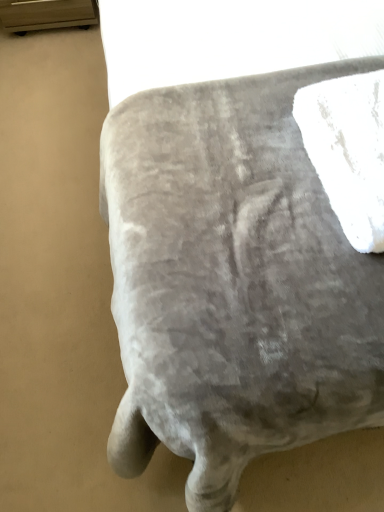
The height and width of the screenshot is (512, 384). I want to click on velvet ottoman at center, so click(233, 282).

This screenshot has height=512, width=384. What do you see at coordinates (233, 282) in the screenshot?
I see `velvet ottoman at center` at bounding box center [233, 282].

What do you see at coordinates (348, 151) in the screenshot?
I see `white fluffy bath towel at upper right` at bounding box center [348, 151].

Find the location of a particular element. The height and width of the screenshot is (512, 384). white fluffy bath towel at upper right is located at coordinates (348, 151).

Find the location of `velvet ottoman at center`. velvet ottoman at center is located at coordinates (233, 282).

Does velvet ottoman at center appear on the right side of white fluffy bath towel at upper right?

In fact, velvet ottoman at center is to the left of white fluffy bath towel at upper right.

Looking at this image, considering the positions of objects velvet ottoman at center and white fluffy bath towel at upper right in the image provided, who is in front, velvet ottoman at center or white fluffy bath towel at upper right?

white fluffy bath towel at upper right is closer to the camera.

Is point (138, 382) closer to viewer compared to point (360, 131)?

Yes, it is.

From the image's perspective, which one is positioned lower, velvet ottoman at center or white fluffy bath towel at upper right?

white fluffy bath towel at upper right, from the image's perspective.

From a real-world perspective, is velvet ottoman at center physically above white fluffy bath towel at upper right?

No.

Looking at their sizes, would you say velvet ottoman at center is wider or thinner than white fluffy bath towel at upper right?

velvet ottoman at center is wider than white fluffy bath towel at upper right.

Can you confirm if velvet ottoman at center is taller than white fluffy bath towel at upper right?

No, velvet ottoman at center is not taller than white fluffy bath towel at upper right.

Does velvet ottoman at center have a larger size compared to white fluffy bath towel at upper right?

Yes.

Is white fluffy bath towel at upper right completely or partially inside velvet ottoman at center?

No, white fluffy bath towel at upper right is not surrounded by velvet ottoman at center.

Is velvet ottoman at center not near white fluffy bath towel at upper right?

No, there isn't a large distance between velvet ottoman at center and white fluffy bath towel at upper right.

Is velvet ottoman at center facing towards white fluffy bath towel at upper right?

No, velvet ottoman at center does not turn towards white fluffy bath towel at upper right.

How different are the orientations of velvet ottoman at center and white fluffy bath towel at upper right in degrees?

The angle between the facing direction of velvet ottoman at center and the facing direction of white fluffy bath towel at upper right is 87.2 degrees.

Identify the location of bath towel that appears below the velvet ottoman at center (from the image's perspective). The width and height of the screenshot is (384, 512). (348, 151).

Considering the relative positions of white fluffy bath towel at upper right and velvet ottoman at center in the image provided, is white fluffy bath towel at upper right to the left of velvet ottoman at center from the viewer's perspective?

No, white fluffy bath towel at upper right is not to the left of velvet ottoman at center.

Is white fluffy bath towel at upper right positioned before velvet ottoman at center?

That is True.

Is point (337, 99) more distant than point (365, 266)?

Yes, it is.

From the image's perspective, which one is positioned higher, white fluffy bath towel at upper right or velvet ottoman at center?

velvet ottoman at center.

From a real-world perspective, is white fluffy bath towel at upper right above or below velvet ottoman at center?

In terms of real-world spatial position, white fluffy bath towel at upper right is above velvet ottoman at center.

Can you confirm if white fluffy bath towel at upper right is thinner than velvet ottoman at center?

Yes.

In terms of height, does white fluffy bath towel at upper right look taller or shorter compared to velvet ottoman at center?

Clearly, white fluffy bath towel at upper right is taller compared to velvet ottoman at center.

In terms of size, does white fluffy bath towel at upper right appear bigger or smaller than velvet ottoman at center?

In the image, white fluffy bath towel at upper right appears to be smaller than velvet ottoman at center.

Would you say white fluffy bath towel at upper right contains velvet ottoman at center?

Definitely not — velvet ottoman at center is not inside white fluffy bath towel at upper right.

From the picture: Is white fluffy bath towel at upper right in contact with velvet ottoman at center?

There is a gap between white fluffy bath towel at upper right and velvet ottoman at center.

Is white fluffy bath towel at upper right positioned with its back to velvet ottoman at center?

That's not correct — white fluffy bath towel at upper right is not looking away from velvet ottoman at center.

How many degrees apart are the facing directions of white fluffy bath towel at upper right and velvet ottoman at center?

The angular difference between white fluffy bath towel at upper right and velvet ottoman at center is 87.2 degrees.

In the image, there is a velvet ottoman at center. Identify the location of bath towel below it (from the image's perspective). The width and height of the screenshot is (384, 512). (348, 151).

Image resolution: width=384 pixels, height=512 pixels. I want to click on furniture behind the white fluffy bath towel at upper right, so point(233,282).

Where is `furniture on the left of white fluffy bath towel at upper right`? This screenshot has width=384, height=512. furniture on the left of white fluffy bath towel at upper right is located at coordinates (233, 282).